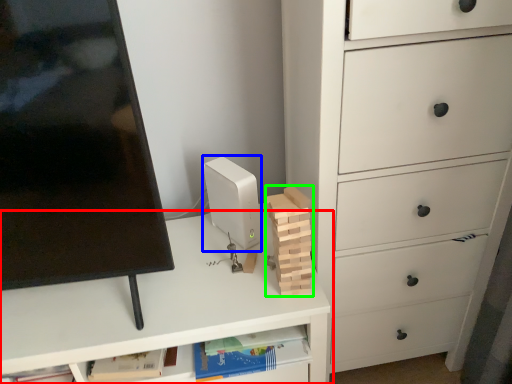
Question: Estimate the real-world distances between objects in this image. Which object is closer to desk (highlighted by a red box), desktop computer (highlighted by a blue box) or block (highlighted by a green box)?

Choices:
 (A) desktop computer
 (B) block

Answer: (A)